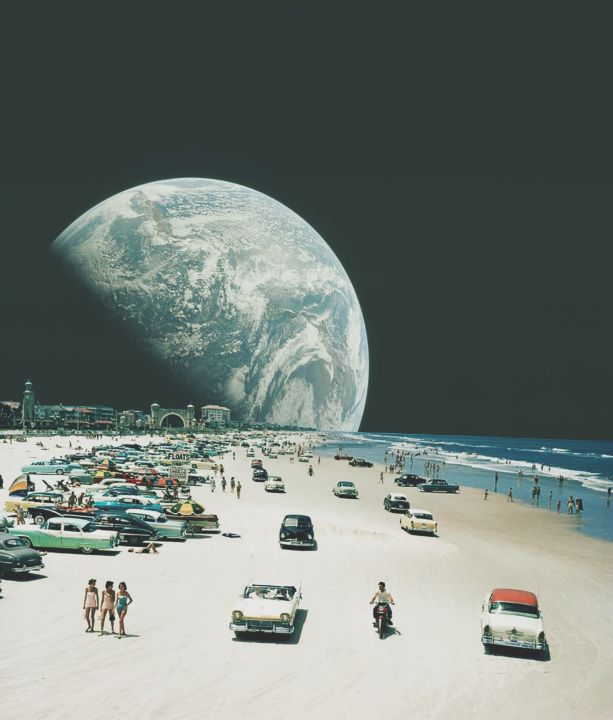
Image resolution: width=613 pixels, height=720 pixels. In order to click on white roof in this screenshot , I will do `click(393, 498)`, `click(414, 510)`, `click(78, 520)`, `click(154, 515)`, `click(143, 499)`.